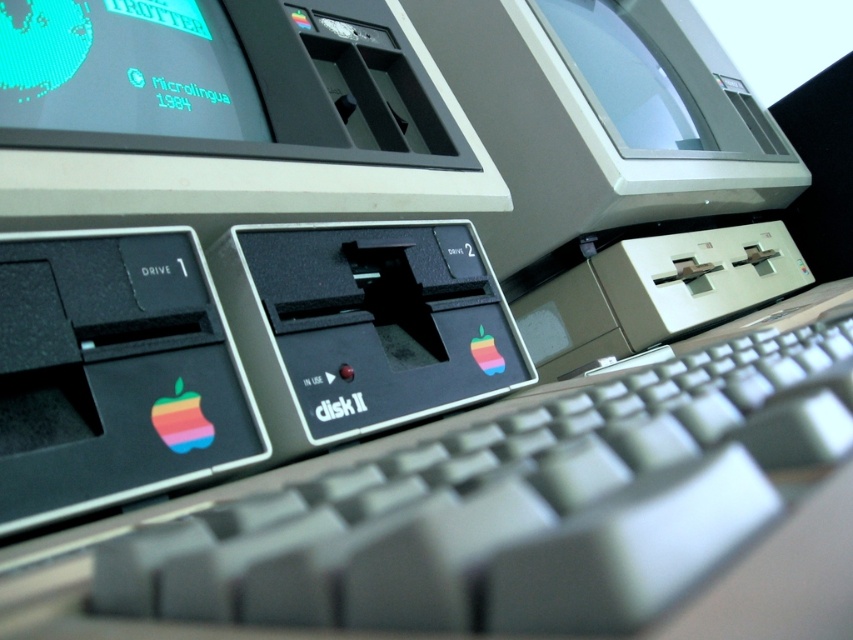
You are setting up an Apple II computer and need to connect the teal matte screen at upper left and the transparent plastic monitor at upper center. According to the image, which one is closer to you?

The teal matte screen at upper left is closer to you because it is in front of the transparent plastic monitor at upper center.

You are setting up a vintage computer display and have both the teal matte screen at upper left and the transparent plastic monitor at upper center. Which one takes up more space in the setup?

The transparent plastic monitor at upper center takes up more space than the teal matte screen at upper left because the teal matte screen at upper left occupies less space than the transparent plastic monitor at upper center.

You are setting up an Apple II computer and need to connect the keyboard to the monitor. According to the image, where is the gray plastic keyboard at center located in relation to the transparent plastic monitor at upper center?

The gray plastic keyboard at center is to the left of the transparent plastic monitor at upper center, so you should connect the keyboard to the left side of the monitor.